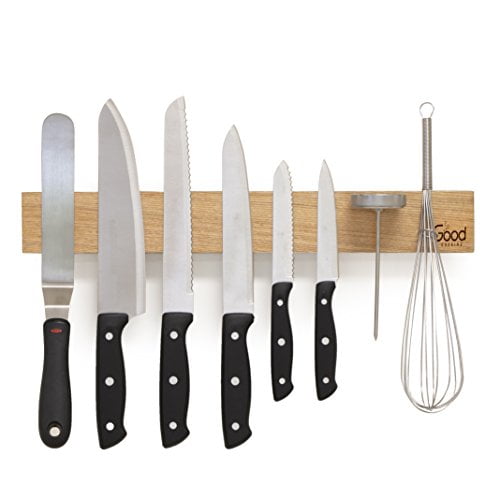
You are a GUI agent. You are given a task and a screenshot of the screen. Output one action in this format:
    pyautogui.click(x=<x>, y=<y>)
    Task: Click on the knife rack
    The image size is (500, 500).
    Given the screenshot: What is the action you would take?
    pyautogui.click(x=363, y=233)